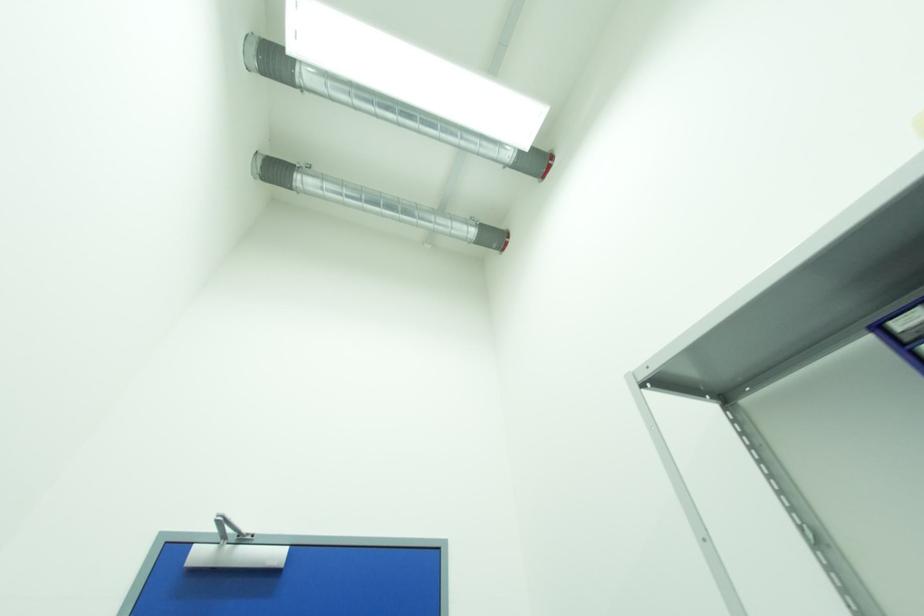
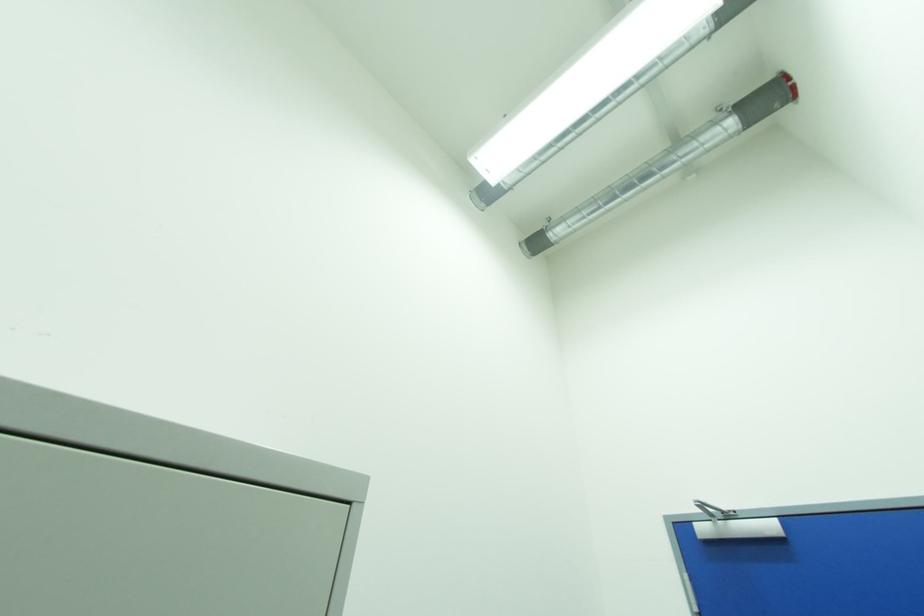
Question: The first image is from the beginning of the video and the second image is from the end. How did the camera likely rotate when shooting the video?

Choices:
 (A) Left
 (B) Right
 (C) Up
 (D) Down

Answer: (A)